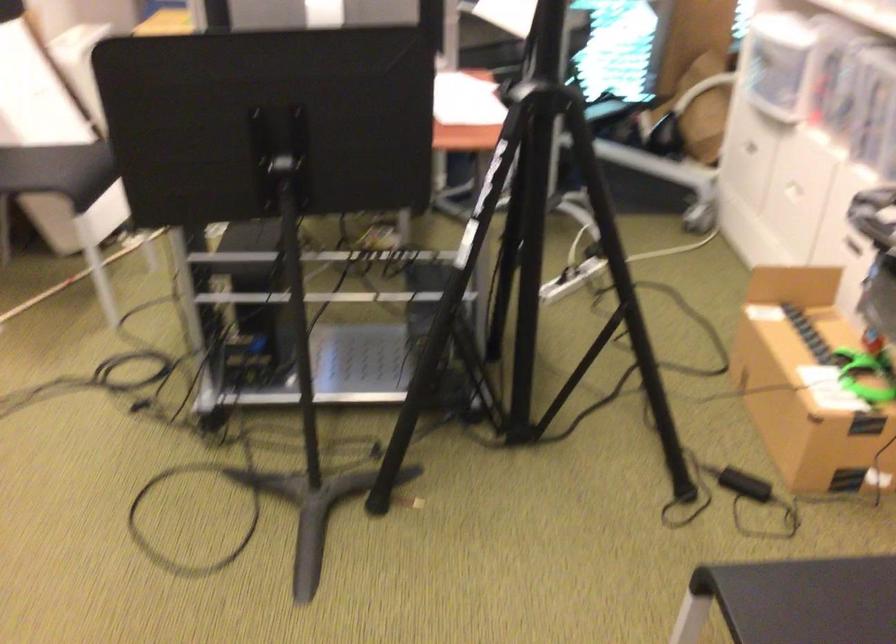
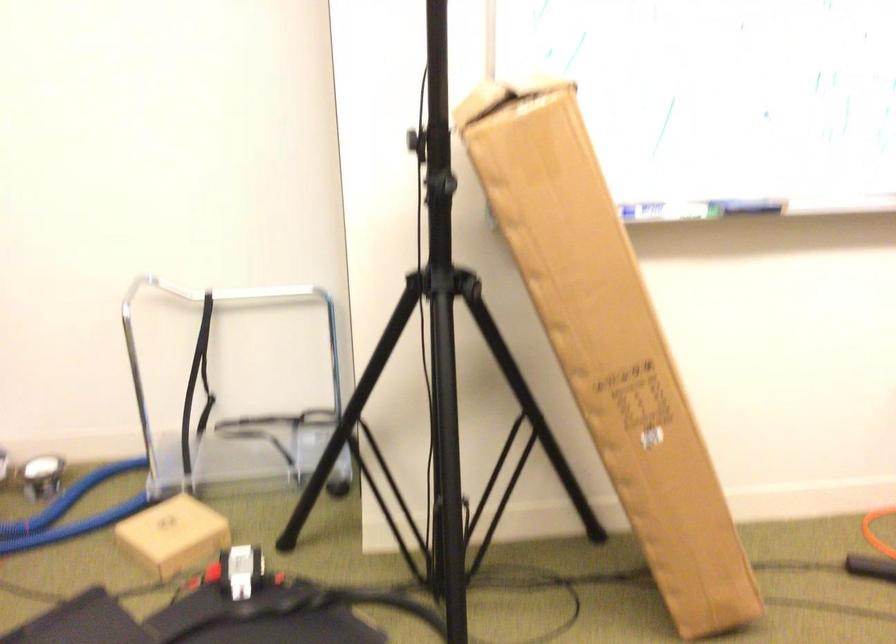
Question: The camera is either moving clockwise (left) or counter-clockwise (right) around the object. The first image is from the beginning of the video and the second image is from the end. Is the camera moving left or right when shooting the video?

Choices:
 (A) Left
 (B) Right

Answer: (B)